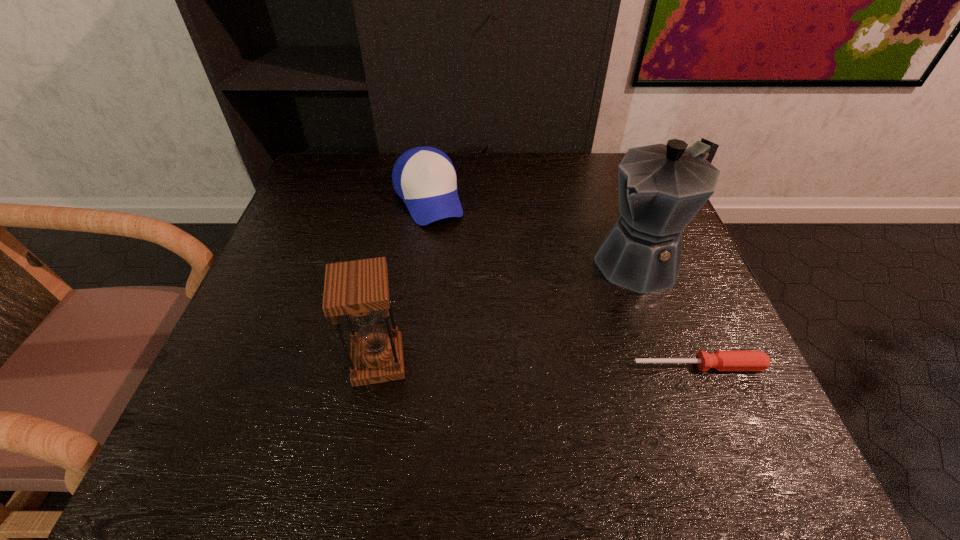
You are a GUI agent. You are given a task and a screenshot of the screen. Output one action in this format:
    pyautogui.click(x=<x>, y=<y>)
    Task: Click on the hourglass
    The image size is (960, 540).
    Given the screenshot: What is the action you would take?
    pyautogui.click(x=359, y=289)

Locate an element on the screen. Image resolution: width=960 pixels, height=540 pixels. the shortest object is located at coordinates (720, 360).

Locate an element on the screen. The image size is (960, 540). the third tallest object is located at coordinates (424, 177).

Identify the location of the farthest object. (424, 177).

Identify the location of coffeepot. This screenshot has height=540, width=960. (662, 187).

The width and height of the screenshot is (960, 540). I want to click on the tallest object, so click(662, 187).

Where is `vacant space located 0.120m on the left of the hourglass`? The height and width of the screenshot is (540, 960). vacant space located 0.120m on the left of the hourglass is located at coordinates (283, 361).

You are a GUI agent. You are given a task and a screenshot of the screen. Output one action in this format:
    pyautogui.click(x=<x>, y=<y>)
    Task: Click on the free space located 0.070m on the front-facing side of the farthest object
    The width and height of the screenshot is (960, 540).
    Given the screenshot: What is the action you would take?
    pyautogui.click(x=443, y=246)

The width and height of the screenshot is (960, 540). Find the location of `free space located 0.280m on the front-facing side of the farthest object`. free space located 0.280m on the front-facing side of the farthest object is located at coordinates (468, 314).

Locate an element on the screen. This screenshot has width=960, height=540. free location located on the front-facing side of the farthest object is located at coordinates (457, 282).